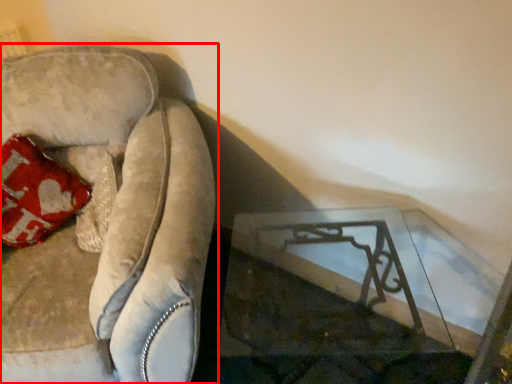
Question: From the image's perspective, where is furniture (annotated by the red box) located relative to table?

Choices:
 (A) above
 (B) below

Answer: (A)